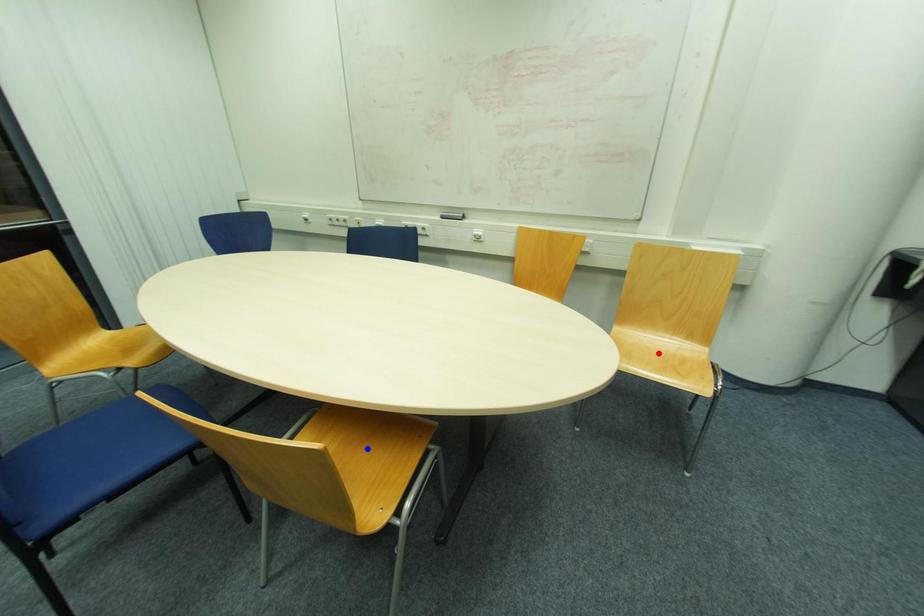
Question: Two points are marked on the image. Which point is closer to the camera?

Choices:
 (A) Blue point is closer.
 (B) Red point is closer.

Answer: (A)